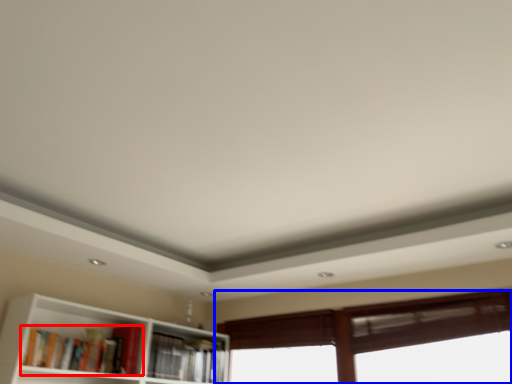
Question: Which object is closer to the camera taking this photo, book (highlighted by a red box) or window (highlighted by a blue box)?

Choices:
 (A) book
 (B) window

Answer: (A)